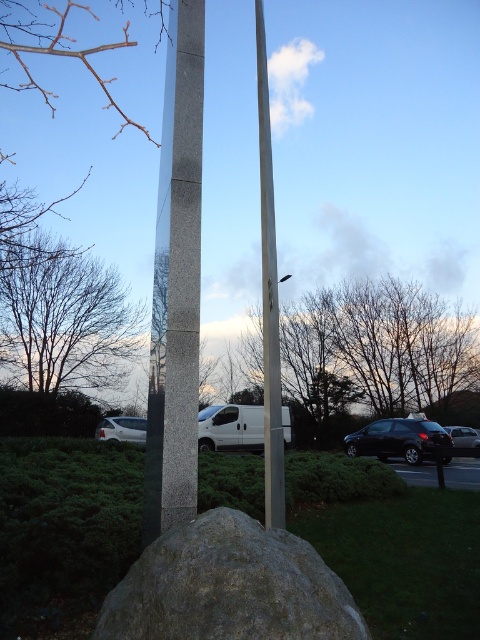
Between white matte van at center and metallic silver car at lower right, which one appears on the right side from the viewer's perspective?

metallic silver car at lower right

Who is more forward, (212, 408) or (458, 436)?

Point (212, 408) is more forward.

I want to click on white matte van at center, so click(230, 428).

Does white matte van at center have a greater height compared to white matte van at lower left?

Correct, white matte van at center is much taller as white matte van at lower left.

Which is more to the right, white matte van at center or white matte van at lower left?

white matte van at center

Does point (230, 432) come in front of point (122, 426)?

Yes, it is.

The height and width of the screenshot is (640, 480). I want to click on white matte van at center, so click(230, 428).

Does polished metal flag pole at center appear on the left side of white matte van at center?

No, polished metal flag pole at center is not to the left of white matte van at center.

The height and width of the screenshot is (640, 480). In order to click on polished metal flag pole at center in this screenshot , I will do `click(268, 300)`.

Where is `polished metal flag pole at center`? This screenshot has width=480, height=640. polished metal flag pole at center is located at coordinates (268, 300).